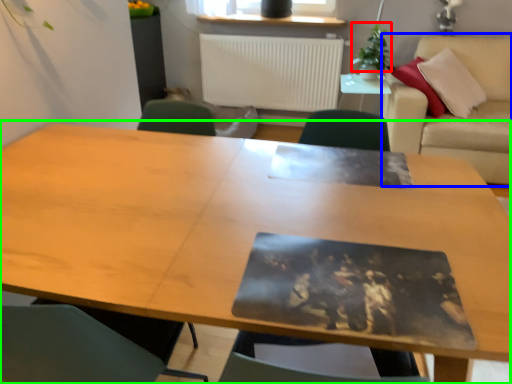
Question: Which object is the closest to the plant (highlighted by a red box)? Choose among these: couch (highlighted by a blue box) or table (highlighted by a green box).

Choices:
 (A) couch
 (B) table

Answer: (A)